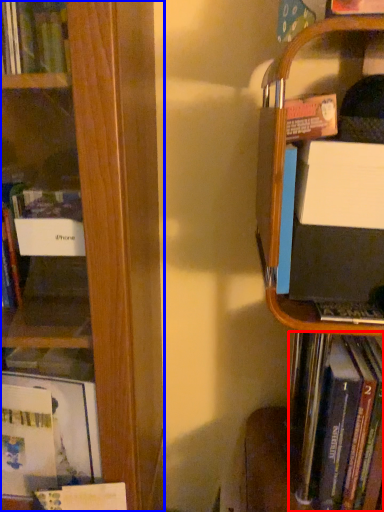
Question: Which of the following is the closest to the observer, book (highlighted by a red box) or book (highlighted by a blue box)?

Choices:
 (A) book
 (B) book

Answer: (B)